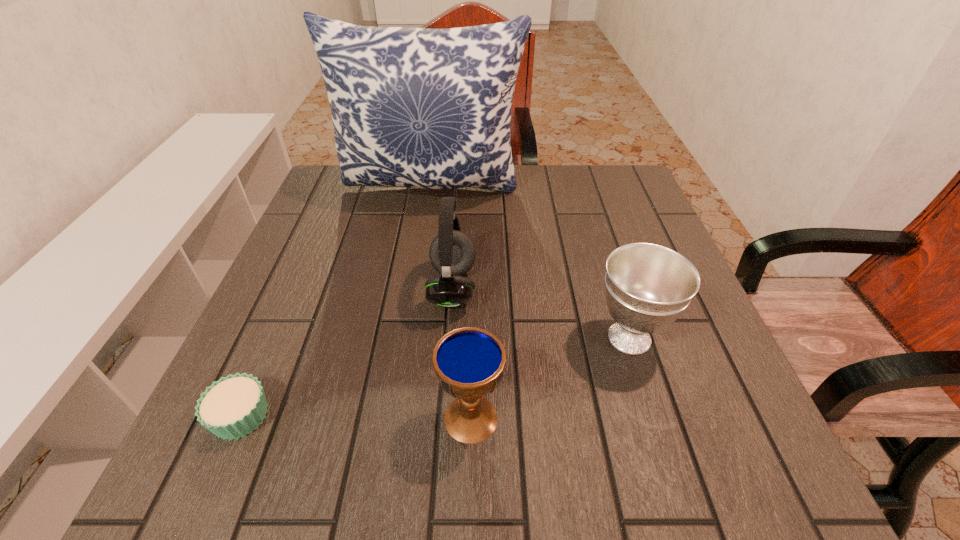
The image size is (960, 540). I want to click on vacant region at the far edge of the desktop, so click(x=518, y=166).

In the image, there is a desktop. Where is `vacant space at the near edge`? The height and width of the screenshot is (540, 960). vacant space at the near edge is located at coordinates (406, 445).

This screenshot has width=960, height=540. I want to click on free location at the left edge of the desktop, so click(x=344, y=230).

You are a GUI agent. You are given a task and a screenshot of the screen. Output one action in this format:
    pyautogui.click(x=<x>, y=<y>)
    Task: Click on the free point at the right edge
    
    Given the screenshot: What is the action you would take?
    pyautogui.click(x=649, y=221)

In the image, there is a desktop. At what (x,y) coordinates should I click in order to perform the action: click on vacant space at the near left corner. Please return your answer as a coordinate pair (x, y). Looking at the image, I should click on [182, 477].

Find the location of a particular element. Image resolution: width=960 pixels, height=540 pixels. free space at the far right corner is located at coordinates (589, 192).

I want to click on free space that is in between the tallest object and the cupcake, so pos(336,302).

Locate an element on the screen. This screenshot has height=540, width=960. vacant space that's between the cupcake and the right chalice is located at coordinates tap(435, 377).

What are the coordinates of `free space between the left chalice and the rightmost object` in the screenshot? It's located at (550, 378).

This screenshot has height=540, width=960. Find the location of `blank region between the right chalice and the left chalice`. blank region between the right chalice and the left chalice is located at coordinates (550, 378).